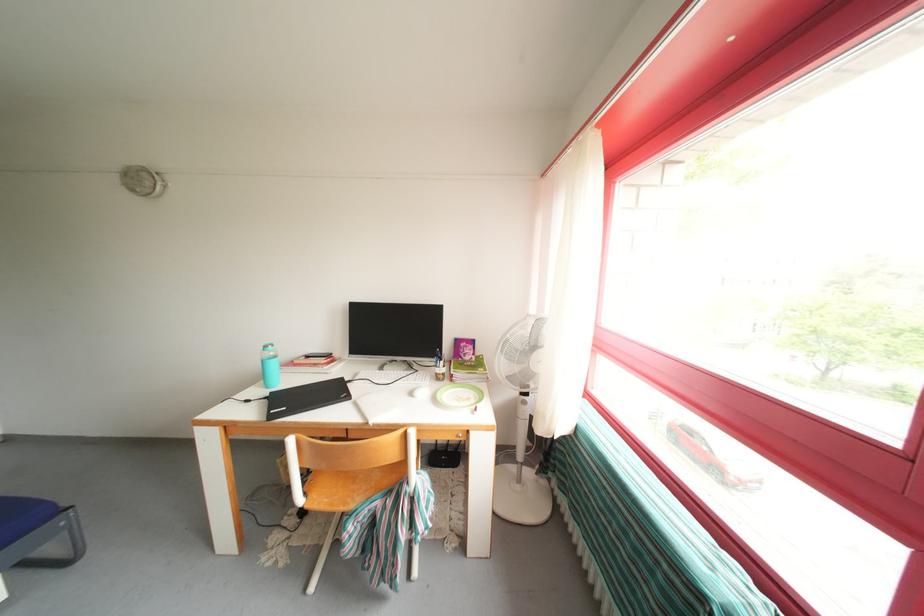
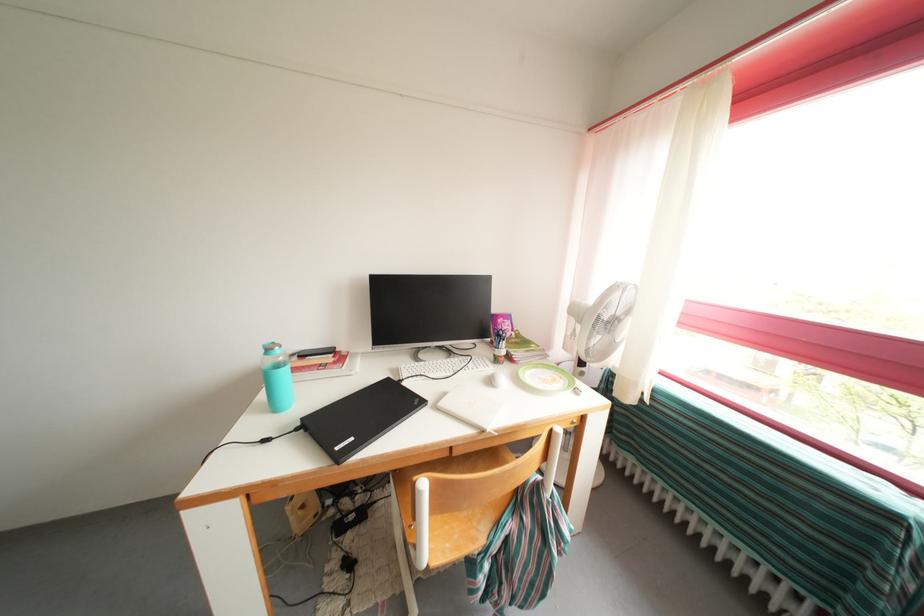
Which direction would the cameraman need to move to produce the second image?

The cameraman walked toward left, forward.